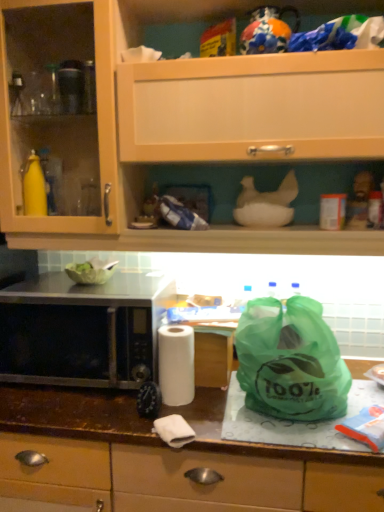
Question: Does point (173, 293) appear closer or farther from the camera than point (175, 389)?

Choices:
 (A) farther
 (B) closer

Answer: (A)

Question: Would you say black matte microwave at left is inside or outside white matte paper towel at center?

Choices:
 (A) inside
 (B) outside

Answer: (B)

Question: Based on their relative distances, which object is nearer to the brown laminate countertop at center?

Choices:
 (A) black matte microwave at left
 (B) white matte paper towel at center
 (C) matte wood cabinet at upper center
 (D) green plastic bag at right

Answer: (A)

Question: Which is farther from the matte wood cabinet at upper center?

Choices:
 (A) white matte paper towel at center
 (B) black matte microwave at left
 (C) green plastic bag at right
 (D) brown laminate countertop at center

Answer: (D)